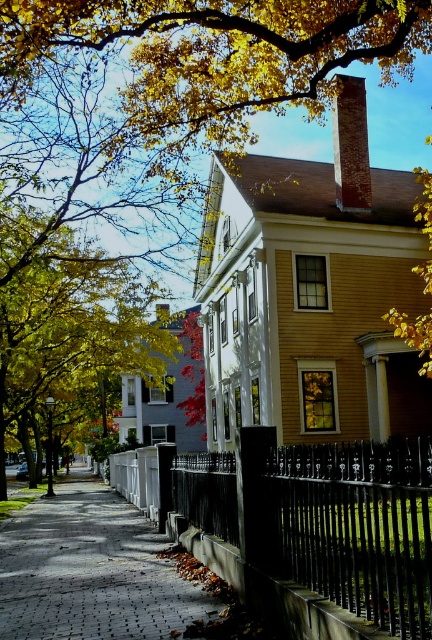
Is yellow-green foliage at center to the left of brick chimney at upper right from the viewer's perspective?

Indeed, yellow-green foliage at center is positioned on the left side of brick chimney at upper right.

Does yellow-green foliage at center appear over brick chimney at upper right?

Actually, yellow-green foliage at center is below brick chimney at upper right.

Is point (25, 289) less distant than point (358, 144)?

No, it is not.

The width and height of the screenshot is (432, 640). I want to click on yellow-green foliage at center, so click(x=70, y=337).

Which is more to the right, yellow-green foliage at center or paved brick sidewalk at center?

From the viewer's perspective, paved brick sidewalk at center appears more on the right side.

Between point (19, 305) and point (206, 602), which one is positioned behind?

The point (19, 305) is more distant.

Locate an element on the screen. This screenshot has width=432, height=640. yellow-green foliage at center is located at coordinates (x=70, y=337).

Can you confirm if golden leafy tree at upper left is positioned to the left of brick chimney at upper right?

Yes, golden leafy tree at upper left is to the left of brick chimney at upper right.

Is point (212, 100) positioned behind point (362, 125)?

No, (212, 100) is closer to viewer.

Locate an element on the screen. The width and height of the screenshot is (432, 640). golden leafy tree at upper left is located at coordinates (219, 52).